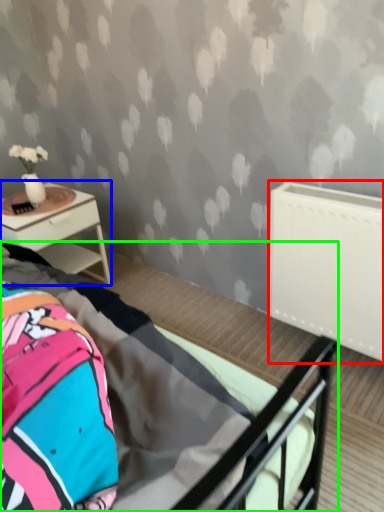
Question: Based on their relative distances, which object is nearer to radiator (highlighted by a red box)? Choose from nightstand (highlighted by a blue box) and bed (highlighted by a green box).

Choices:
 (A) nightstand
 (B) bed

Answer: (B)